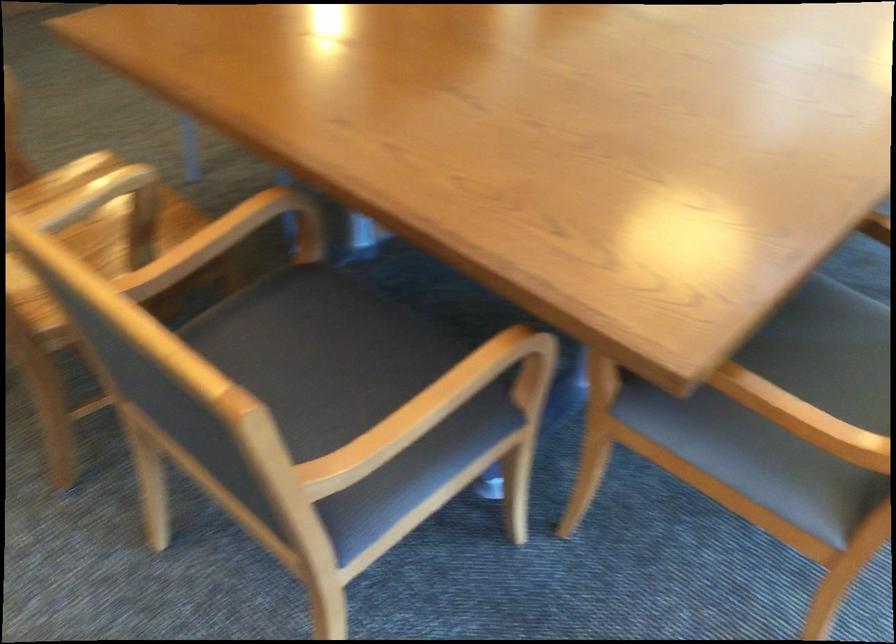
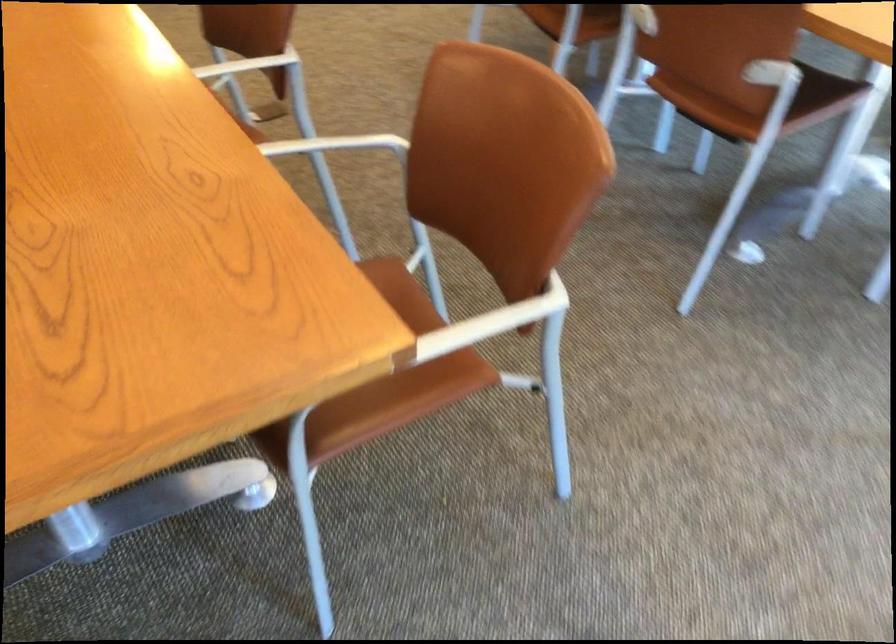
What movement of the cameraman would produce the second image?

The cameraman walked toward right, forward.